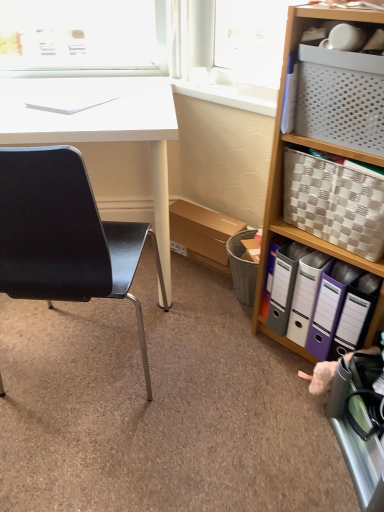
Locate an element on the screen. The width and height of the screenshot is (384, 512). blank space above white glossy desk at left (from a real-world perspective) is located at coordinates (73, 100).